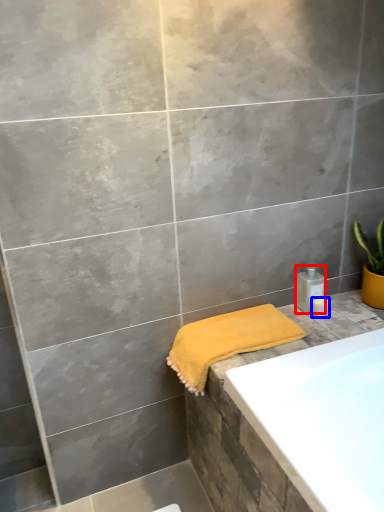
Question: Which object is further to the camera taking this photo, toiletry (highlighted by a red box) or toiletry (highlighted by a blue box)?

Choices:
 (A) toiletry
 (B) toiletry

Answer: (A)